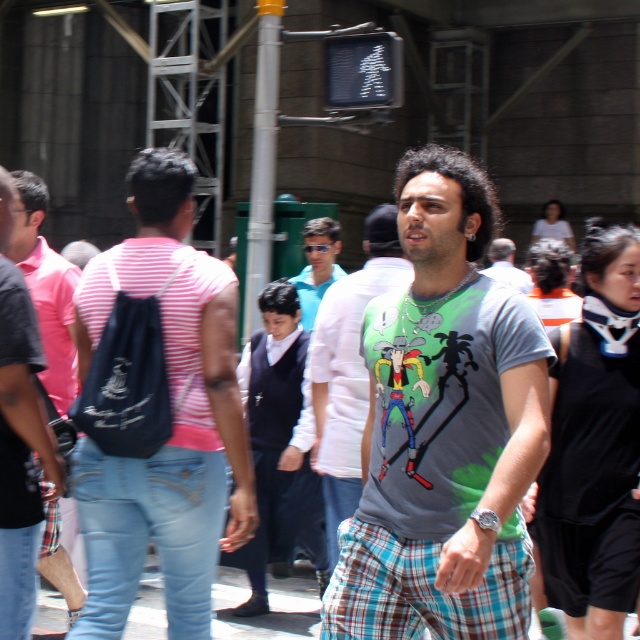
Question: Is gray printed t-shirt at center closer to the viewer compared to blue plaid pants at center?

Choices:
 (A) no
 (B) yes

Answer: (B)

Question: Estimate the real-world distances between objects in this image. Which object is farther from the green printed t-shirt at center?

Choices:
 (A) gray t-shirt at center
 (B) matte black backpack at left
 (C) gray printed t-shirt at center

Answer: (A)

Question: Which object appears closest to the camera in this image?

Choices:
 (A) matte black backpack at left
 (B) green printed t-shirt at center
 (C) blue plaid pants at center

Answer: (A)

Question: Can you confirm if gray printed t-shirt at center is positioned above blue plaid pants at center?

Choices:
 (A) no
 (B) yes

Answer: (B)

Question: Is matte black backpack at left thinner than green printed t-shirt at center?

Choices:
 (A) no
 (B) yes

Answer: (B)

Question: Which point is closer to the camera?

Choices:
 (A) (528, 273)
 (B) (8, 592)
 (C) (412, 465)

Answer: (C)